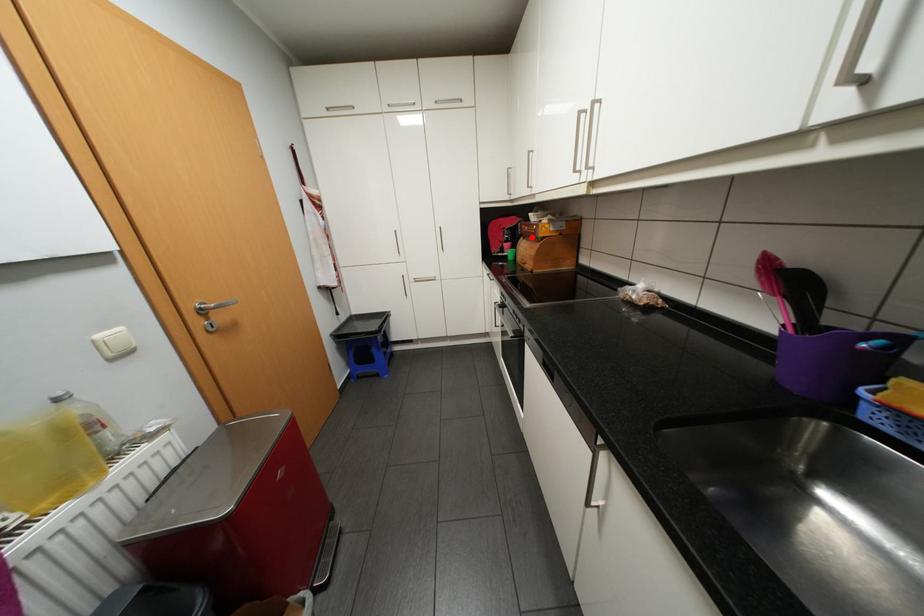
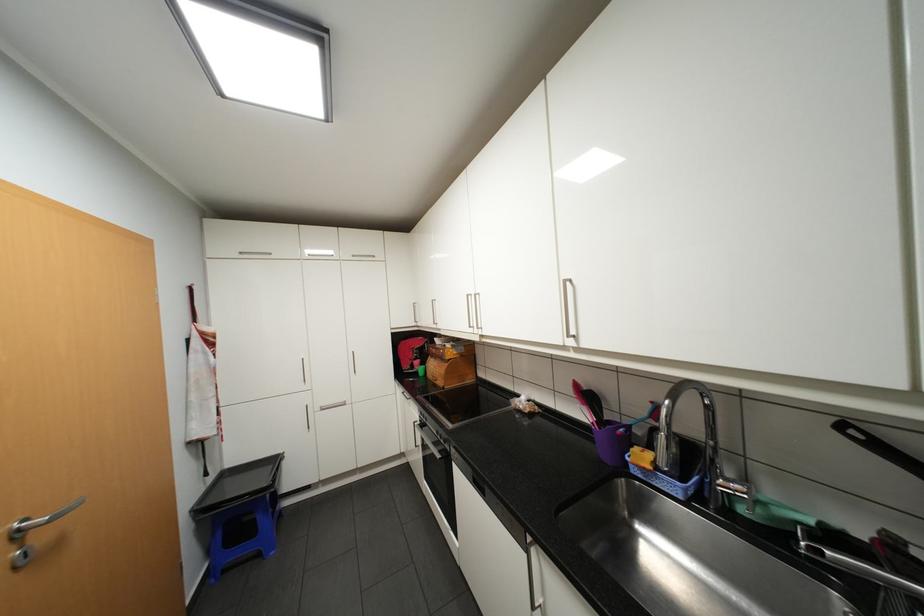
In the second image, find the point that corresponds to the highlighted location in the first image.

(440, 355)